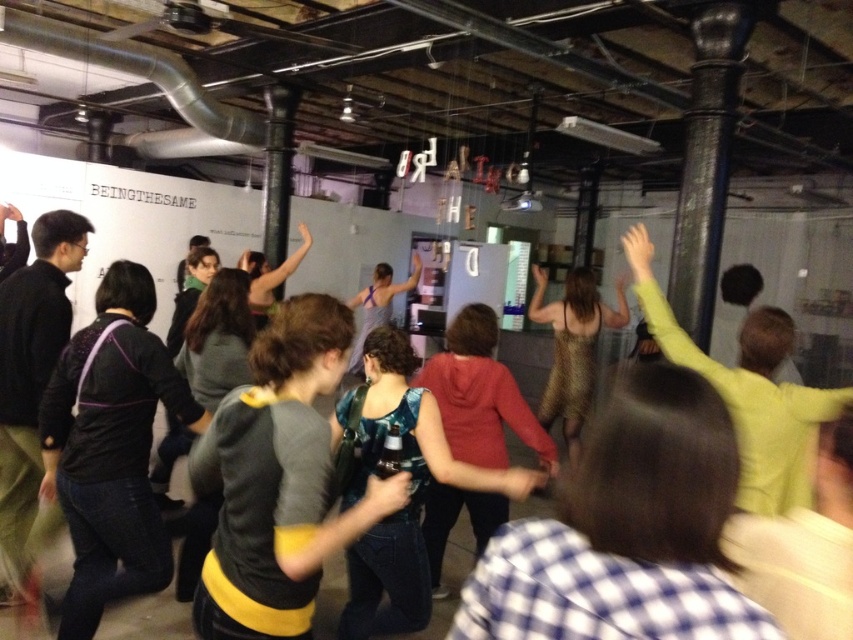
Is checkered shirt at center below dark gray sweater at center?

Incorrect, checkered shirt at center is not positioned below dark gray sweater at center.

Which is behind, point (728, 467) or point (244, 625)?

The point (244, 625) is more distant.

Is point (720, 410) in front of point (265, 435)?

Yes, it is in front of point (265, 435).

What are the coordinates of `checkered shirt at center` in the screenshot? It's located at (625, 531).

Does black fabric jacket at center appear on the left side of light green sweater at upper right?

Yes, black fabric jacket at center is to the left of light green sweater at upper right.

Is point (67, 616) behind point (662, 353)?

That is False.

Where is `black fabric jacket at center`? black fabric jacket at center is located at coordinates (111, 449).

This screenshot has height=640, width=853. Describe the element at coordinates (625, 531) in the screenshot. I see `checkered shirt at center` at that location.

Is checkered shirt at center further to camera compared to gold sequined dress at center?

No, checkered shirt at center is in front of gold sequined dress at center.

Is point (567, 531) positioned after point (581, 413)?

No, it is in front of (581, 413).

Find the location of a particular element. The width and height of the screenshot is (853, 640). checkered shirt at center is located at coordinates (625, 531).